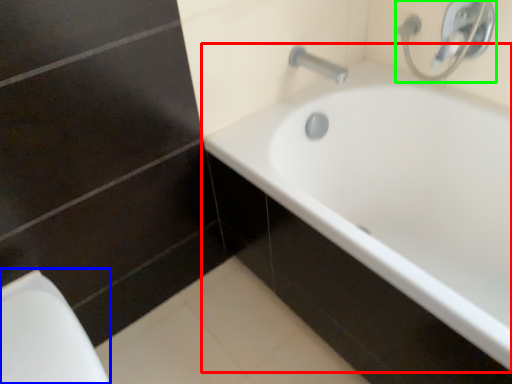
Question: Which object is positioned farthest from bathtub (highlighted by a red box)? Select from porcelain (highlighted by a blue box) and plumbing fixture (highlighted by a green box).

Choices:
 (A) porcelain
 (B) plumbing fixture

Answer: (A)